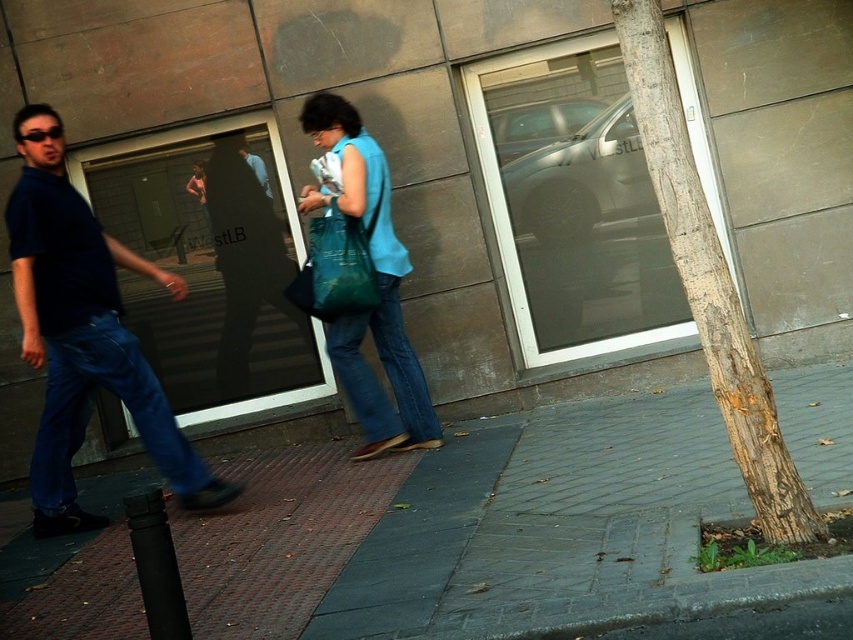
You are a delivery person trying to place a package between the brown textured bark at right and the matte green fabric bag at center. The package is 1.2 meters wide. Can it fit between them?

The brown textured bark at right is wider than the matte green fabric bag at center. However, the description does not provide the exact distance between them, so it is unclear if the 1.2 meter package can fit.

You are a tailor observing two pairs of jeans in the image. The first is blue denim jeans at left, and the second is matte blue jeans at center. Which pair has a wider leg opening?

The blue denim jeans at left might be wider than matte blue jeans at center.